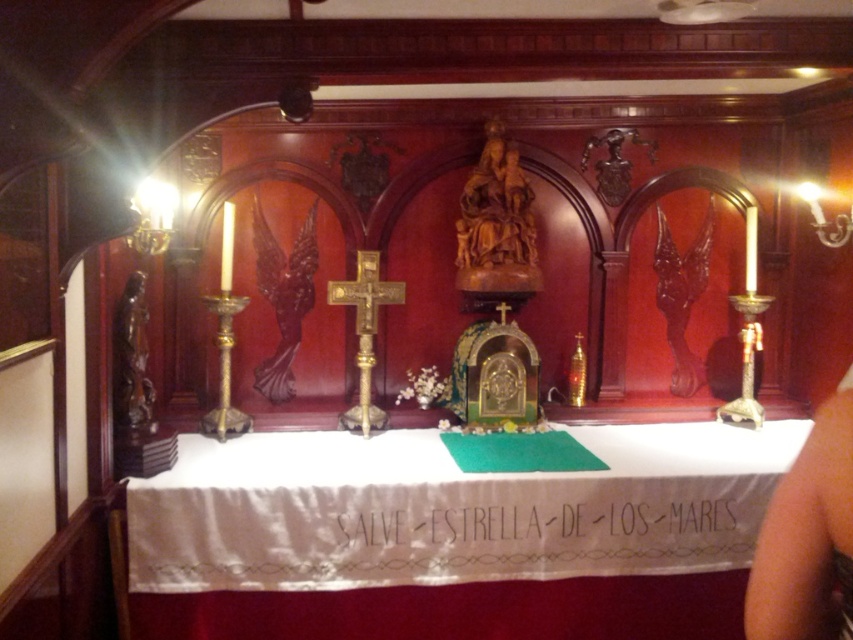
Does white satin tablecloth at center appear over black fabric at center?

Correct, white satin tablecloth at center is located above black fabric at center.

Looking at this image, who is more forward, (198, 456) or (524, 538)?

Point (524, 538) is more forward.

Identify the location of white satin tablecloth at center. (451, 536).